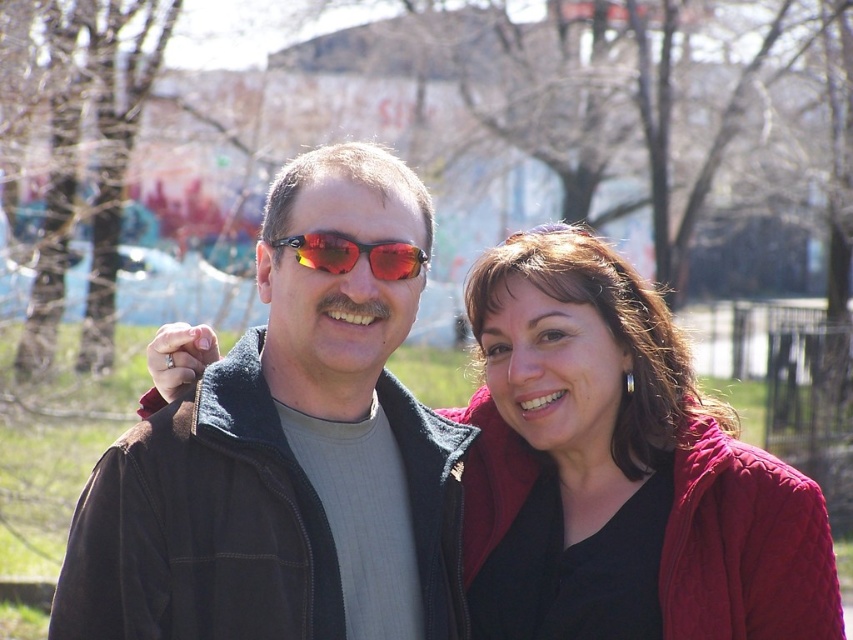
You are a photographer trying to capture a group photo of the matte black jacket at center and the corduroy red jacket at center. The minimum distance your camera can focus on two objects clearly is 40 inches. Will you be able to take a clear photo of both jackets at the same time?

The matte black jacket at center and corduroy red jacket at center are 37.20 inches apart from each other. Since this distance is less than the camera minimum focus distance of 40 inches, the photographer can take a clear photo of both jackets at the same time.

You are a photographer trying to capture a clear shot of both the corduroy red jacket at center and the red reflective lens sunglasses at center. Since both are at the center, how can you adjust your camera angle to ensure both are fully visible in the frame?

The corduroy red jacket at center is taller than the red reflective lens sunglasses at center. To ensure both are fully visible, tilt the camera slightly downward so the taller jacket remains in frame while the shorter sunglasses stay within the bottom portion of the shot.